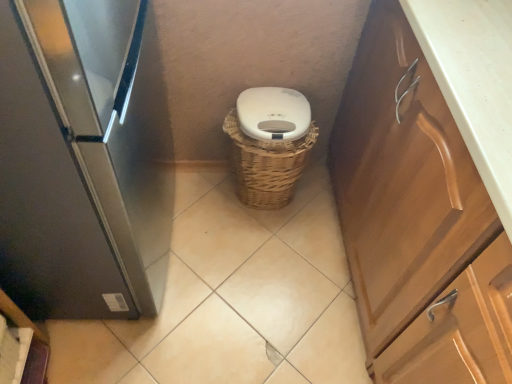
At what (x,y) coordinates should I click in order to perform the action: click on vacant space in front of woven brown basket at center. Please return your answer as a coordinate pair (x, y). This screenshot has width=512, height=384. Looking at the image, I should click on (259, 246).